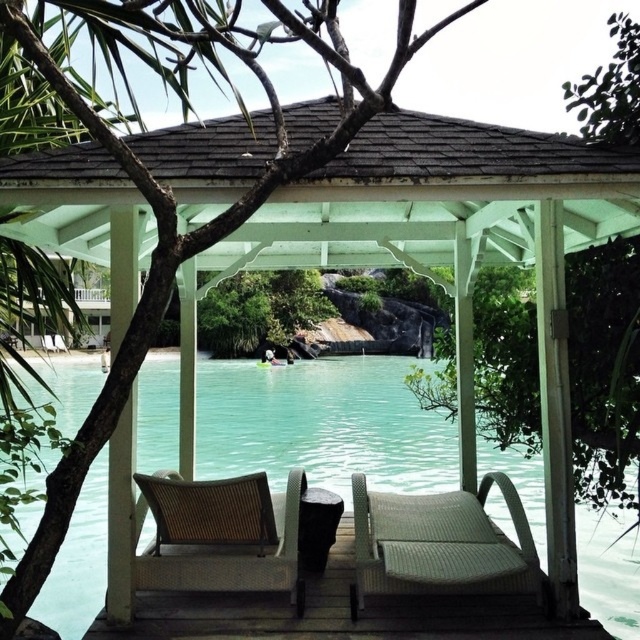
Question: Which of the following is the closest to the observer?

Choices:
 (A) turquoise water at center
 (B) woven rattan chair at center

Answer: (A)

Question: Can you confirm if turquoise water at center is positioned below woven rattan chair at center?

Choices:
 (A) yes
 (B) no

Answer: (A)

Question: Is woven rattan lounge chair at center below woven rattan chair at center?

Choices:
 (A) yes
 (B) no

Answer: (A)

Question: Among these points, which one is farthest from the camera?

Choices:
 (A) (36, 518)
 (B) (374, 538)

Answer: (A)

Question: Does woven rattan lounge chair at center appear on the left side of woven rattan chair at center?

Choices:
 (A) yes
 (B) no

Answer: (B)

Question: Which of the following is the closest to the observer?

Choices:
 (A) pos(225,516)
 (B) pos(400,506)
 (C) pos(536,484)

Answer: (A)